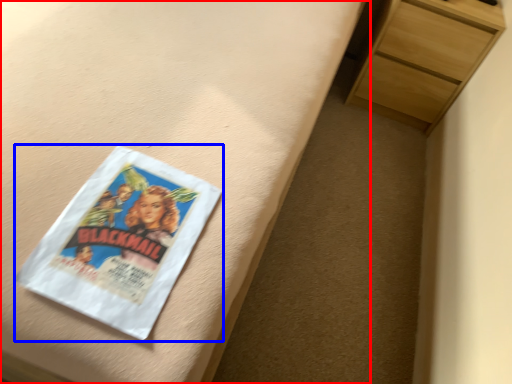
Question: Which point is further to the camera, bed frame (highlighted by a red box) or paperback book (highlighted by a blue box)?

Choices:
 (A) bed frame
 (B) paperback book

Answer: (B)